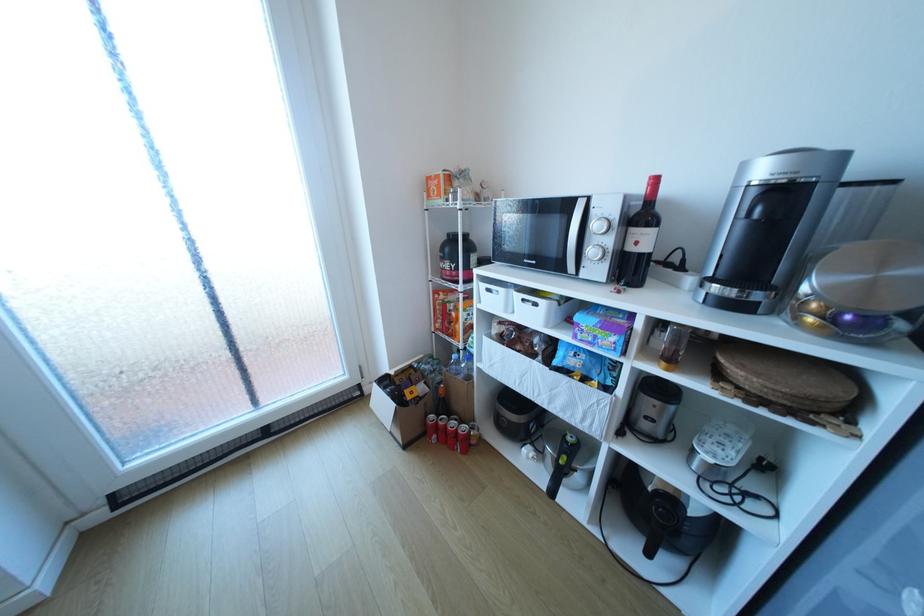
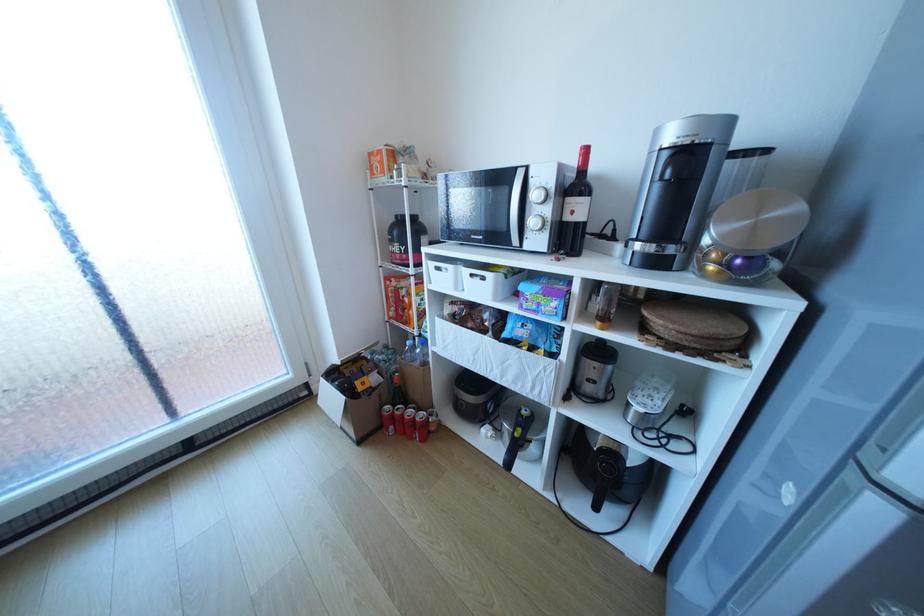
Where in the second image is the point corresponding to (554,456) from the first image?

(513, 434)